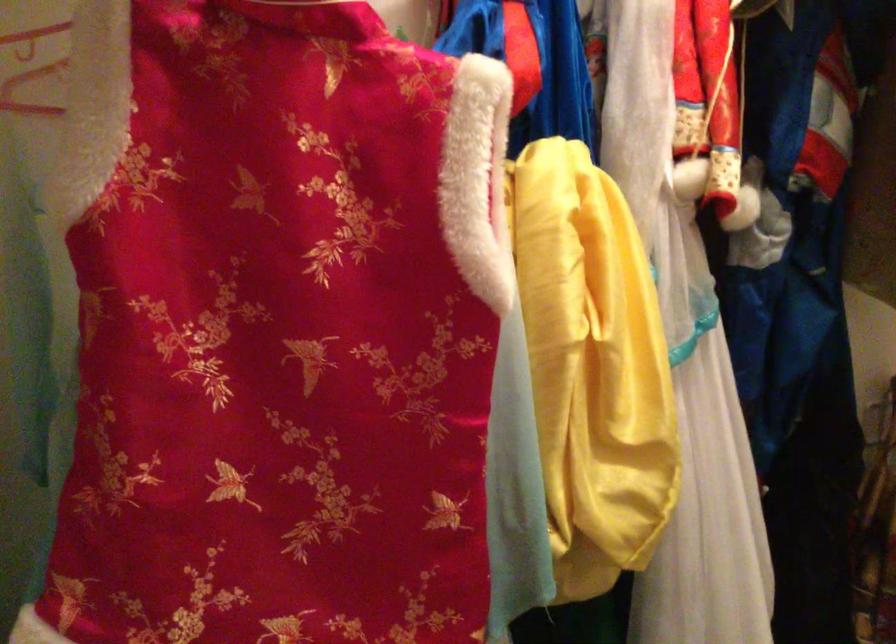
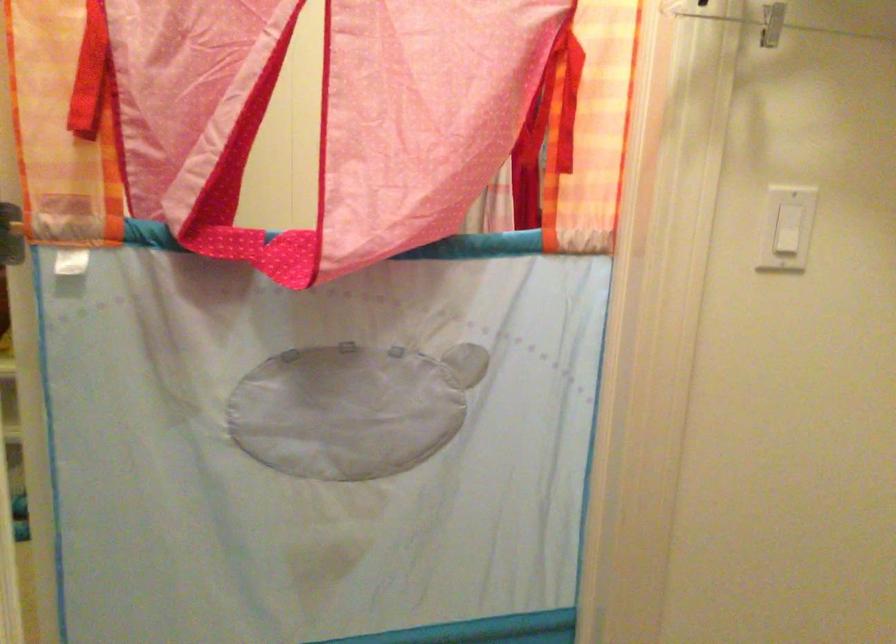
Question: How did the camera likely rotate?

Choices:
 (A) Left
 (B) Right
 (C) Up
 (D) Down

Answer: (B)